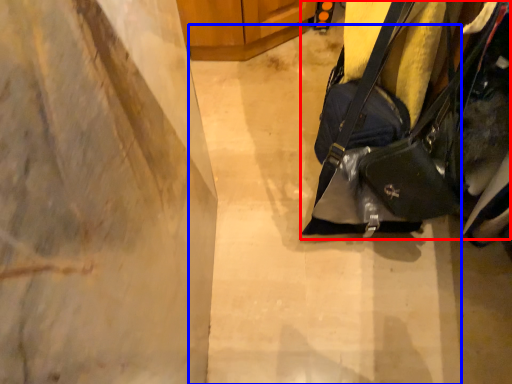
Question: Which point is further to the camera, handbag (highlighted by a red box) or concrete (highlighted by a blue box)?

Choices:
 (A) handbag
 (B) concrete

Answer: (B)